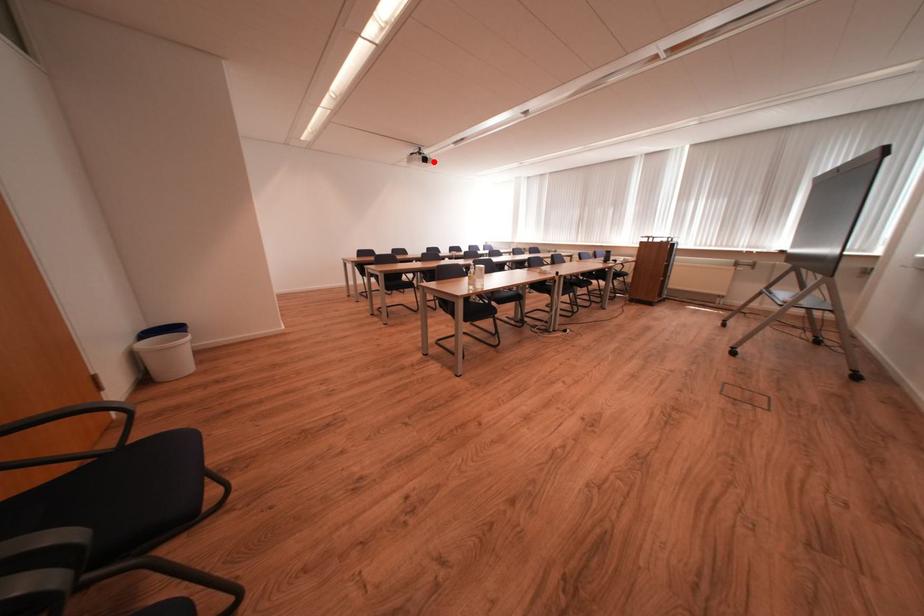
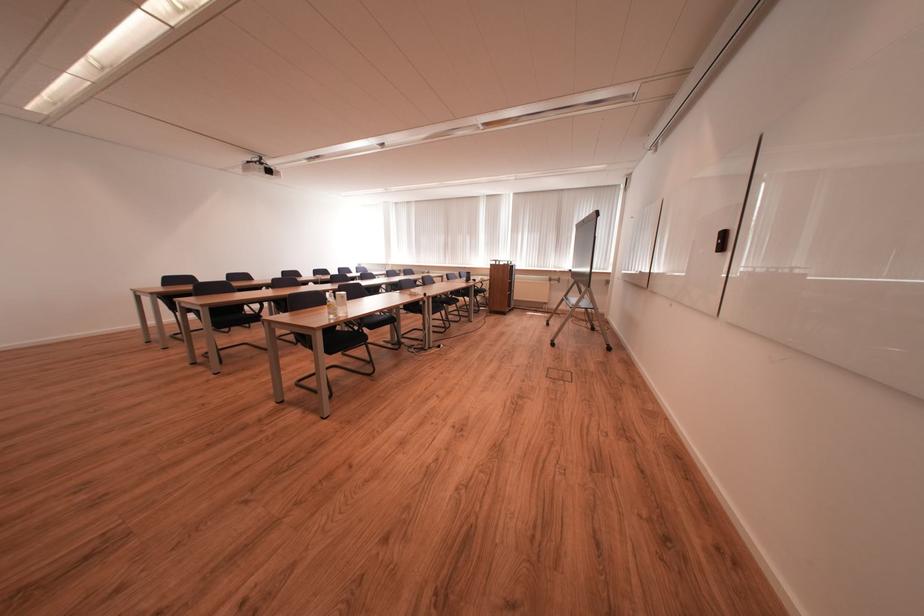
Where in the second image is the point corresponding to the highlighted location from the first image?

(277, 174)